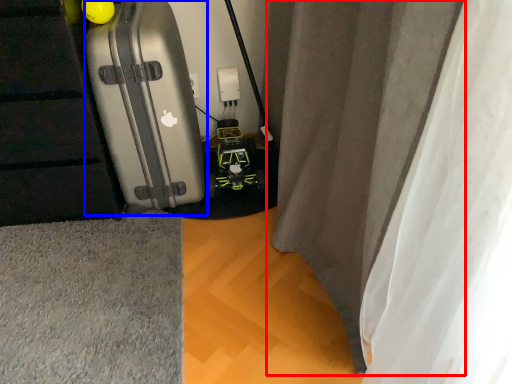
Question: Which of the following is the closest to the observer, curtain (highlighted by a red box) or suitcase (highlighted by a blue box)?

Choices:
 (A) curtain
 (B) suitcase

Answer: (A)